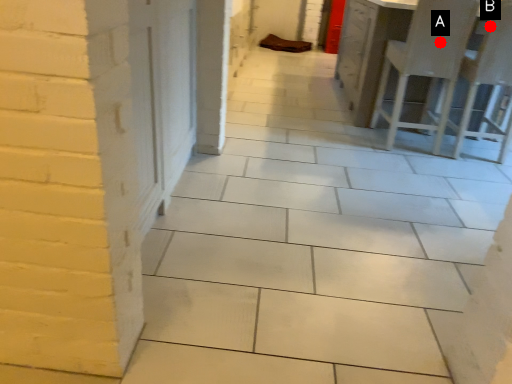
Question: Two points are circled on the image, labeled by A and B beside each circle. Which point appears farthest from the camera in this image?

Choices:
 (A) A is further
 (B) B is further

Answer: (A)